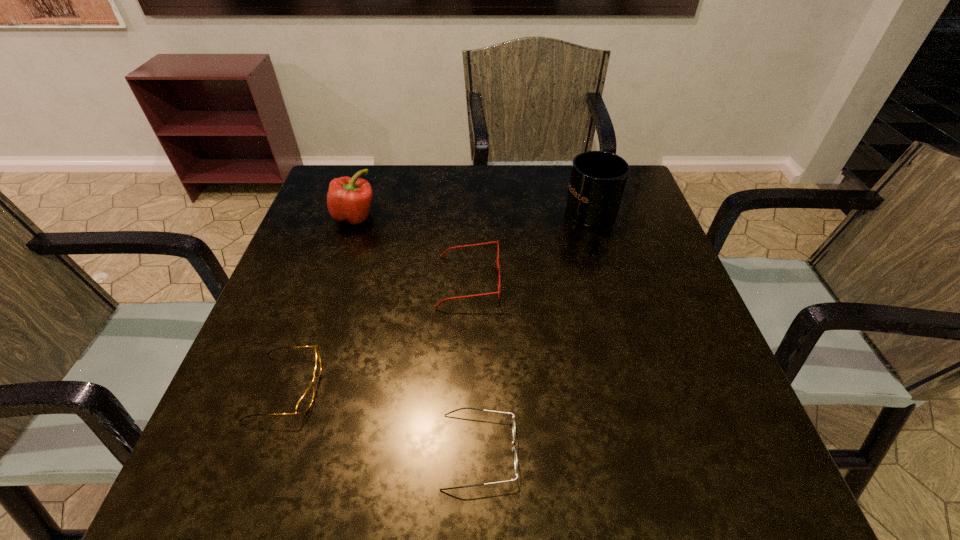
Where is `vacant space at the left edge of the desktop`? The image size is (960, 540). vacant space at the left edge of the desktop is located at coordinates (365, 222).

Locate an element on the screen. This screenshot has width=960, height=540. vacant space at the right edge of the desktop is located at coordinates (644, 239).

Locate an element on the screen. The height and width of the screenshot is (540, 960). vacant space at the far left corner is located at coordinates (329, 179).

The height and width of the screenshot is (540, 960). Identify the location of vacant region at the near left corner of the desktop. (232, 467).

Find the location of `vacant area at the far right corner`. vacant area at the far right corner is located at coordinates (621, 215).

This screenshot has width=960, height=540. Identify the location of unoccupied area between the bell pepper and the leftmost spectacles. (321, 302).

Locate an element on the screen. The width and height of the screenshot is (960, 540). free spot between the third farthest object and the leftmost spectacles is located at coordinates [x=377, y=334].

Where is `free area in between the leftmost spectacles and the second tallest object`? Image resolution: width=960 pixels, height=540 pixels. free area in between the leftmost spectacles and the second tallest object is located at coordinates (321, 302).

Identify the location of free spot between the third shortest object and the bell pepper. The width and height of the screenshot is (960, 540). (412, 249).

Select which object appears as the third closest to the second tallest object. Please provide its 2D coordinates. Your answer should be formatted as a tuple, i.e. [(x, y)], where the tuple contains the x and y coordinates of a point satisfying the conditions above.

[(598, 178)]